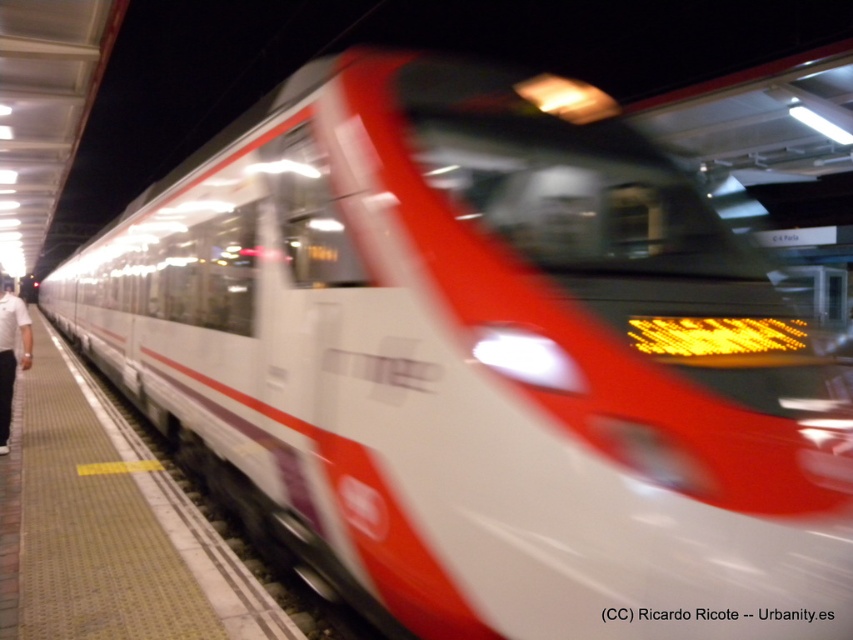
Question: Which point is farther from the camera taking this photo?

Choices:
 (A) (57, 365)
 (B) (3, 445)

Answer: (A)

Question: Can you confirm if yellow textured platform at lower left is positioned below white cotton shirt at left?

Choices:
 (A) yes
 (B) no

Answer: (A)

Question: Can you confirm if yellow textured platform at lower left is wider than white cotton shirt at left?

Choices:
 (A) no
 (B) yes

Answer: (A)

Question: Is yellow textured platform at lower left above white cotton shirt at left?

Choices:
 (A) yes
 (B) no

Answer: (B)

Question: Which point is closer to the camera taking this photo?

Choices:
 (A) (24, 333)
 (B) (39, 628)

Answer: (B)

Question: Which of the following is the closest to the observer?

Choices:
 (A) yellow textured platform at lower left
 (B) white cotton shirt at left

Answer: (A)